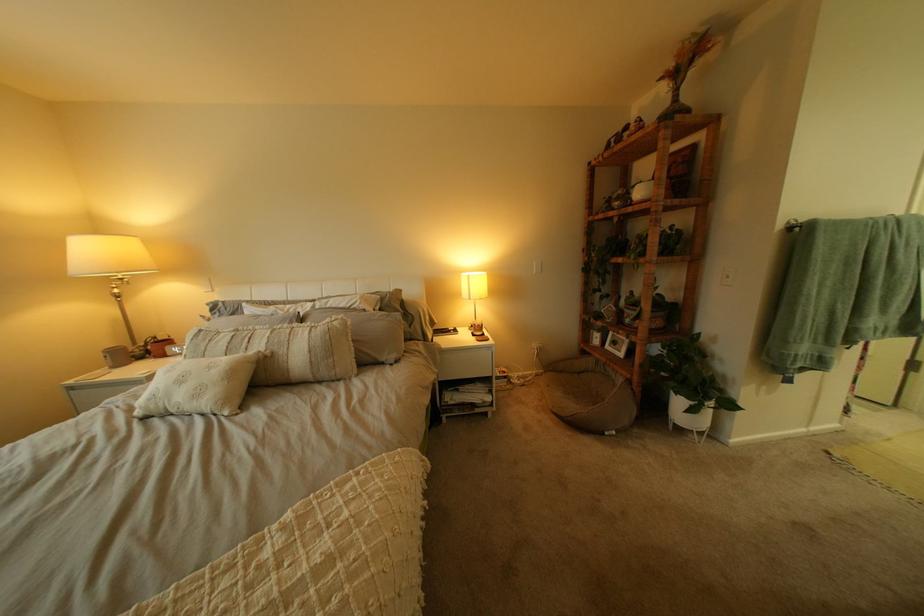
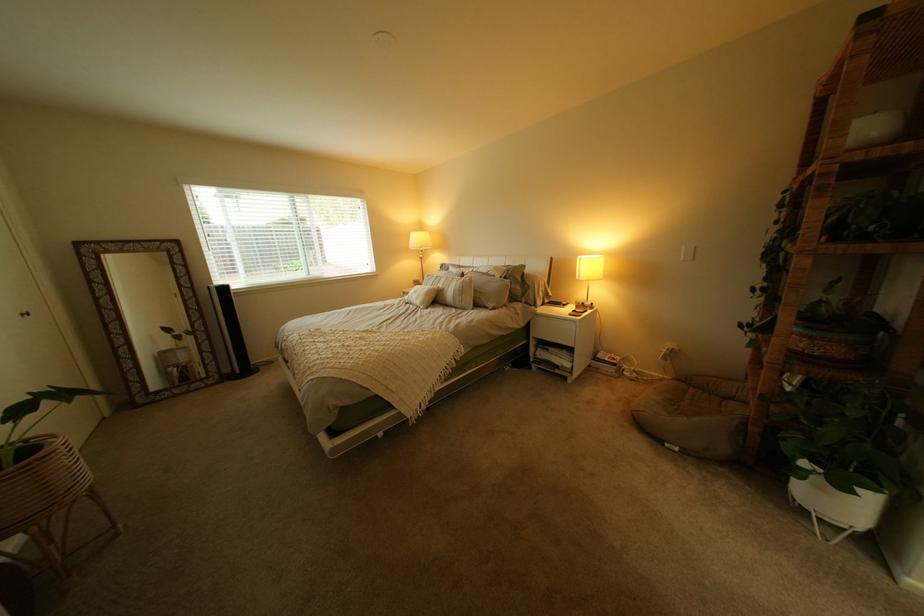
In the second image, find the point that corresponds to the point at 493,339 in the first image.

(590, 314)